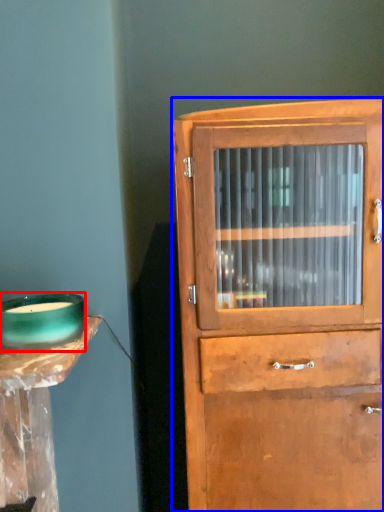
Question: Which of the following is the farthest to the observer, candle holder (highlighted by a red box) or cupboard (highlighted by a blue box)?

Choices:
 (A) candle holder
 (B) cupboard

Answer: (B)